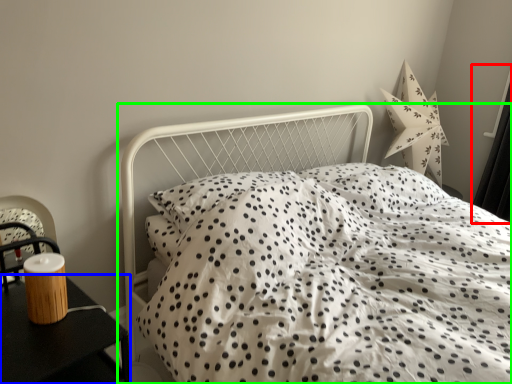
Question: Which is farther away from curtain (highlighted by a red box)? nightstand (highlighted by a blue box) or bed (highlighted by a green box)?

Choices:
 (A) nightstand
 (B) bed

Answer: (A)